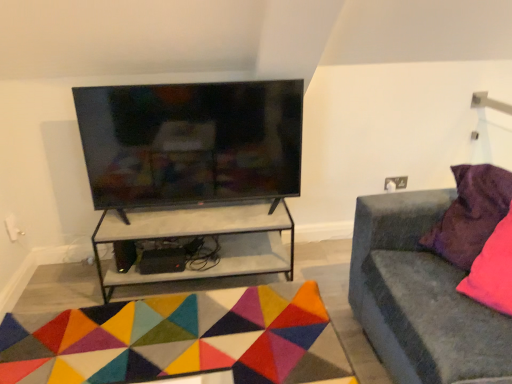
Measure the distance between point (121, 133) and camera.

Point (121, 133) and camera are 2.12 meters apart from each other.

The image size is (512, 384). What do you see at coordinates (203, 241) in the screenshot? I see `white concrete shelf at center` at bounding box center [203, 241].

Where is `black glossy tv at upper center`? Image resolution: width=512 pixels, height=384 pixels. black glossy tv at upper center is located at coordinates (191, 142).

Which is more to the left, white concrete shelf at center or black glossy tv at upper center?

white concrete shelf at center.

Is white concrete shelf at center oriented towards black glossy tv at upper center?

No, white concrete shelf at center is not facing towards black glossy tv at upper center.

How much distance is there between white concrete shelf at center and black glossy tv at upper center?

white concrete shelf at center and black glossy tv at upper center are 11.62 inches apart.

Is point (97, 245) positioned before point (156, 97)?

No, it is not.

Is black glossy tv at upper center located outside purple velvet pillow at right?

black glossy tv at upper center lies outside purple velvet pillow at right's area.

Which object is positioned more to the right, black glossy tv at upper center or purple velvet pillow at right?

purple velvet pillow at right is more to the right.

Does black glossy tv at upper center have a smaller size compared to purple velvet pillow at right?

No, black glossy tv at upper center is not smaller than purple velvet pillow at right.

From a real-world perspective, relative to black glossy tv at upper center, is multicolored felt mat at center vertically above or below?

multicolored felt mat at center is situated lower than black glossy tv at upper center in the real world.

I want to click on mat to the left of black glossy tv at upper center, so click(x=179, y=339).

In terms of size, does multicolored felt mat at center appear bigger or smaller than black glossy tv at upper center?

In the image, multicolored felt mat at center appears to be smaller than black glossy tv at upper center.

Does multicolored felt mat at center appear on the right side of black glossy tv at upper center?

In fact, multicolored felt mat at center is to the left of black glossy tv at upper center.

Between purple velvet pillow at right and white concrete shelf at center, which one is positioned in front?

purple velvet pillow at right.

Is purple velvet pillow at right in contact with white concrete shelf at center?

No, purple velvet pillow at right is not next to white concrete shelf at center.

In the scene shown: Which is closer to the camera, (476, 171) or (253, 233)?

Point (476, 171) appears to be closer to the viewer than point (253, 233).

Is purple velvet pillow at right aimed at multicolored felt mat at center?

No, purple velvet pillow at right does not turn towards multicolored felt mat at center.

From a real-world perspective, which is physically below, purple velvet pillow at right or multicolored felt mat at center?

multicolored felt mat at center.

Which is in front, point (460, 202) or point (106, 344)?

The point (460, 202) is in front.

Does purple velvet pillow at right have a smaller size compared to multicolored felt mat at center?

Correct, purple velvet pillow at right occupies less space than multicolored felt mat at center.

From the image's perspective, is multicolored felt mat at center located above or below white concrete shelf at center?

Based on their image positions, multicolored felt mat at center is located beneath white concrete shelf at center.

Based on their sizes in the image, would you say multicolored felt mat at center is bigger or smaller than white concrete shelf at center?

Considering their sizes, multicolored felt mat at center takes up less space than white concrete shelf at center.

Is multicolored felt mat at center positioned in front of white concrete shelf at center?

Yes, it is in front of white concrete shelf at center.

Consider the image. From a real-world perspective, which is physically below, multicolored felt mat at center or white concrete shelf at center?

multicolored felt mat at center is physically lower.

Considering the relative positions of multicolored felt mat at center and purple velvet pillow at right in the image provided, is multicolored felt mat at center to the left or to the right of purple velvet pillow at right?

From the image, it's evident that multicolored felt mat at center is to the left of purple velvet pillow at right.

Considering the sizes of objects multicolored felt mat at center and purple velvet pillow at right in the image provided, who is shorter, multicolored felt mat at center or purple velvet pillow at right?

Standing shorter between the two is multicolored felt mat at center.

Is multicolored felt mat at center positioned before purple velvet pillow at right?

No, multicolored felt mat at center is behind purple velvet pillow at right.

Are multicolored felt mat at center and purple velvet pillow at right beside each other?

No, multicolored felt mat at center is not making contact with purple velvet pillow at right.

Where is `shelf below the black glossy tv at upper center (from the image's perspective)`? shelf below the black glossy tv at upper center (from the image's perspective) is located at coordinates (203, 241).

At what (x,y) coordinates should I click in order to perform the action: click on television that appears behind the purple velvet pillow at right. Please return your answer as a coordinate pair (x, y). Looking at the image, I should click on (191, 142).

Considering their positions, is velvet grey couch at right positioned further to purple velvet pillow at right than black glossy tv at upper center?

black glossy tv at upper center is further to purple velvet pillow at right.

Considering their positions, is velvet grey couch at right positioned further to multicolored felt mat at center than black glossy tv at upper center?

black glossy tv at upper center is positioned further to the anchor multicolored felt mat at center.

Looking at the image, which one is located closer to velvet grey couch at right, purple velvet pillow at right or white concrete shelf at center?

purple velvet pillow at right is closer to velvet grey couch at right.

In the scene shown: From the image, which object appears to be nearer to black glossy tv at upper center, white concrete shelf at center or velvet grey couch at right?

white concrete shelf at center is positioned closer to the anchor black glossy tv at upper center.

From the image, which object appears to be farther from black glossy tv at upper center, multicolored felt mat at center or white concrete shelf at center?

The object further to black glossy tv at upper center is multicolored felt mat at center.

From the picture: From the image, which object appears to be nearer to velvet grey couch at right, purple velvet pillow at right or multicolored felt mat at center?

Based on the image, purple velvet pillow at right appears to be nearer to velvet grey couch at right.

Considering their positions, is black glossy tv at upper center positioned closer to white concrete shelf at center than purple velvet pillow at right?

black glossy tv at upper center is closer to white concrete shelf at center.

Estimate the real-world distances between objects in this image. Which object is further from white concrete shelf at center, multicolored felt mat at center or velvet grey couch at right?

velvet grey couch at right.

Find the location of a particular element. The width and height of the screenshot is (512, 384). pillow between black glossy tv at upper center and velvet grey couch at right from left to right is located at coordinates (471, 213).

Find the location of `pillow between white concrete shelf at center and velvet grey couch at right in the horizontal direction`. pillow between white concrete shelf at center and velvet grey couch at right in the horizontal direction is located at coordinates (471, 213).

Locate an element on the screen. Image resolution: width=512 pixels, height=384 pixels. television between white concrete shelf at center and velvet grey couch at right in the horizontal direction is located at coordinates (191, 142).

At what (x,y) coordinates should I click in order to perform the action: click on pillow located between multicolored felt mat at center and velvet grey couch at right in the left-right direction. Please return your answer as a coordinate pair (x, y). Looking at the image, I should click on (471, 213).